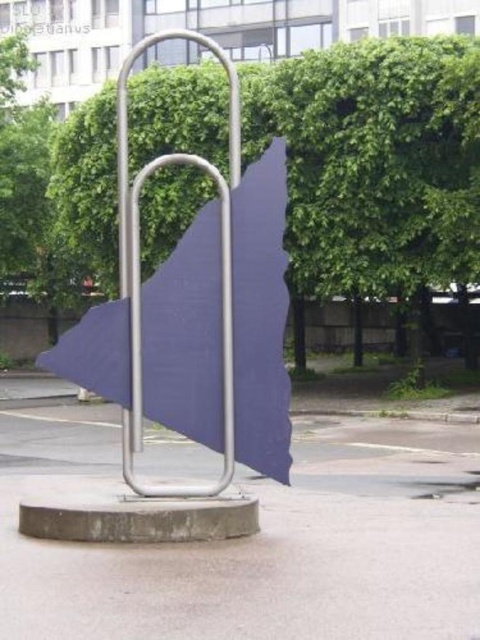
Can you confirm if satin silver paperclip at center is positioned above satin silver pole at center?

Correct, satin silver paperclip at center is located above satin silver pole at center.

Is satin silver paperclip at center wider than satin silver pole at center?

No, satin silver paperclip at center is not wider than satin silver pole at center.

Measure the distance between satin silver paperclip at center and camera.

A distance of 7.11 meters exists between satin silver paperclip at center and camera.

Locate an element on the screen. The width and height of the screenshot is (480, 640). satin silver paperclip at center is located at coordinates (x=196, y=314).

Does green leafy tree at center have a lesser height compared to satin silver paperclip at center?

Yes.

Is point (297, 209) positioned in front of point (120, 188)?

That is False.

Locate an element on the screen. This screenshot has height=640, width=480. green leafy tree at center is located at coordinates (374, 163).

Looking at this image, does green leafy tree at center have a larger size compared to satin silver pole at center?

No.

How much distance is there between green leafy tree at center and satin silver pole at center?

The distance of green leafy tree at center from satin silver pole at center is 3.06 meters.

Which is behind, point (348, 83) or point (121, 452)?

The point (348, 83) is behind.

I want to click on green leafy tree at center, so click(x=374, y=163).